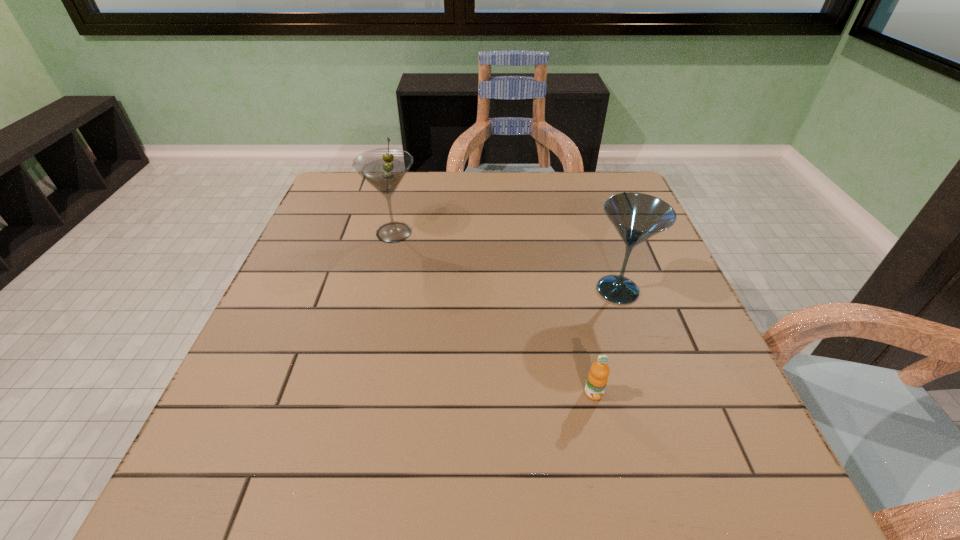
Identify the location of object that is positioned at the right edge. Image resolution: width=960 pixels, height=540 pixels. (637, 217).

Image resolution: width=960 pixels, height=540 pixels. In the image, there is a desktop. In order to click on vacant space at the far edge in this screenshot , I will do `click(489, 172)`.

Find the location of a particular element. free space at the near edge of the desktop is located at coordinates (471, 487).

In the image, there is a desktop. Find the location of `vacant area at the left edge`. vacant area at the left edge is located at coordinates (210, 448).

Where is `vacant space at the right edge of the desktop`? vacant space at the right edge of the desktop is located at coordinates (693, 401).

Identify the location of free region at the far right corner. (611, 192).

You are a GUI agent. You are given a task and a screenshot of the screen. Output one action in this format:
    pyautogui.click(x=<x>, y=<y>)
    Task: Click on the empty space between the rightmost object and the shortest object
    
    Given the screenshot: What is the action you would take?
    pyautogui.click(x=606, y=342)

At what (x,y) coordinates should I click in order to perform the action: click on free point between the nearer martini and the orange juice. Please return your answer as a coordinate pair (x, y). Image resolution: width=960 pixels, height=540 pixels. Looking at the image, I should click on (606, 342).

Locate an element on the screen. This screenshot has width=960, height=540. vacant area between the second object from right to left and the farther martini is located at coordinates (493, 313).

This screenshot has height=540, width=960. I want to click on free space between the second object from left to right and the farthest object, so click(493, 313).